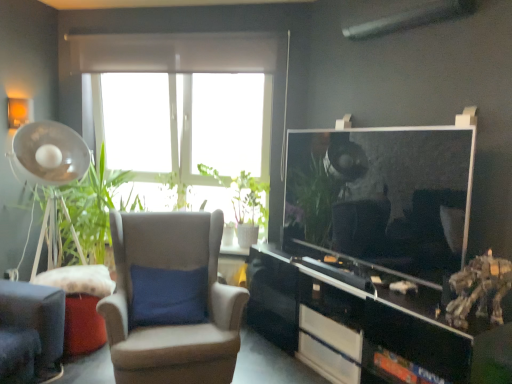
Where is `suede wingback chair at center`? The image size is (512, 384). suede wingback chair at center is located at coordinates (170, 301).

What do you see at coordinates (371, 323) in the screenshot? The image size is (512, 384). I see `black glossy cabinet at lower right` at bounding box center [371, 323].

Locate an element on the screen. Image resolution: width=512 pixels, height=384 pixels. white glossy drawer at lower center, which ranks as the 2th drawer in bottom-to-top order is located at coordinates (331, 332).

The height and width of the screenshot is (384, 512). I want to click on suede wingback chair at center, so click(x=170, y=301).

Could you tell me if green matte plant at center is facing white glossy drawer at lower center, placed as the first drawer when sorted from bottom to top?

No, green matte plant at center is not aimed at white glossy drawer at lower center, placed as the first drawer when sorted from bottom to top.

Is green matte plant at center behind white glossy drawer at lower center, placed as the first drawer when sorted from bottom to top?

Yes, green matte plant at center is further from the viewer.

Is green matte plant at center at the right side of white glossy drawer at lower center, placed as the 2th drawer when sorted from top to bottom?

No, green matte plant at center is not to the right of white glossy drawer at lower center, placed as the 2th drawer when sorted from top to bottom.

From a real-world perspective, who is located lower, green matte plant at center or white glossy drawer at lower center, placed as the first drawer when sorted from bottom to top?

In real-world perspective, white glossy drawer at lower center, placed as the first drawer when sorted from bottom to top, is lower.

Is white glossy drawer at lower center, placed as the first drawer when sorted from bottom to top, wider or thinner than white glossy drawer at lower center, which is the 1th drawer in top-to-bottom order?

Considering their sizes, white glossy drawer at lower center, placed as the first drawer when sorted from bottom to top, looks slimmer than white glossy drawer at lower center, which is the 1th drawer in top-to-bottom order.

What's the angular difference between white glossy drawer at lower center, placed as the 2th drawer when sorted from top to bottom, and white glossy drawer at lower center, which ranks as the 2th drawer in bottom-to-top order,'s facing directions?

0.000309 degrees.

Which of these two, white glossy drawer at lower center, placed as the first drawer when sorted from bottom to top, or white glossy drawer at lower center, which is the 1th drawer in top-to-bottom order, stands shorter?

With less height is white glossy drawer at lower center, placed as the first drawer when sorted from bottom to top.

From the picture: Is white glossy drawer at lower center, placed as the first drawer when sorted from bottom to top, aimed at white glossy drawer at lower center, which ranks as the 2th drawer in bottom-to-top order?

No, white glossy drawer at lower center, placed as the first drawer when sorted from bottom to top, is not turned towards white glossy drawer at lower center, which ranks as the 2th drawer in bottom-to-top order.

Which object is thinner, white glossy drawer at lower center, which ranks as the 2th drawer in bottom-to-top order, or suede wingback chair at center?

white glossy drawer at lower center, which ranks as the 2th drawer in bottom-to-top order, is thinner.

Who is taller, white glossy drawer at lower center, which is the 1th drawer in top-to-bottom order, or suede wingback chair at center?

With more height is suede wingback chair at center.

Is white glossy drawer at lower center, which ranks as the 2th drawer in bottom-to-top order, looking in the opposite direction of suede wingback chair at center?

white glossy drawer at lower center, which ranks as the 2th drawer in bottom-to-top order, does not have its back to suede wingback chair at center.

How far apart are white glossy drawer at lower center, which ranks as the 2th drawer in bottom-to-top order, and suede wingback chair at center?

They are 88.09 centimeters apart.

Which is correct: black glossy cabinet at lower right is inside green matte plant at center, or outside of it?

black glossy cabinet at lower right is located beyond the bounds of green matte plant at center.

In the scene shown: Can you confirm if black glossy cabinet at lower right is bigger than green matte plant at center?

Yes.

Considering the positions of objects black glossy cabinet at lower right and green matte plant at center in the image provided, who is more to the right, black glossy cabinet at lower right or green matte plant at center?

From the viewer's perspective, black glossy cabinet at lower right appears more on the right side.

The height and width of the screenshot is (384, 512). What are the coordinates of `houseplant behind the black glossy cabinet at lower right` in the screenshot? It's located at (249, 206).

Which is in front, point (334, 345) or point (499, 383)?

Positioned in front is point (499, 383).

Looking at this image, from a real-world perspective, relative to black glossy cabinet at lower right, is white glossy drawer at lower center, which ranks as the 2th drawer in bottom-to-top order, vertically above or below?

From a real-world perspective, white glossy drawer at lower center, which ranks as the 2th drawer in bottom-to-top order, is physically below black glossy cabinet at lower right.

How different are the orientations of white glossy drawer at lower center, which ranks as the 2th drawer in bottom-to-top order, and black glossy cabinet at lower right in degrees?

The angular difference between white glossy drawer at lower center, which ranks as the 2th drawer in bottom-to-top order, and black glossy cabinet at lower right is 0.0832 degrees.

Could you tell me if white glossy drawer at lower center, which is the 1th drawer in top-to-bottom order, is facing black glossy cabinet at lower right?

Yes, white glossy drawer at lower center, which is the 1th drawer in top-to-bottom order, is aimed at black glossy cabinet at lower right.

Between black glossy cabinet at lower right and white glossy drawer at lower center, which ranks as the 2th drawer in bottom-to-top order, which one appears on the left side from the viewer's perspective?

From the viewer's perspective, white glossy drawer at lower center, which ranks as the 2th drawer in bottom-to-top order, appears more on the left side.

Is black glossy cabinet at lower right taller than white glossy drawer at lower center, which ranks as the 2th drawer in bottom-to-top order?

Indeed, black glossy cabinet at lower right has a greater height compared to white glossy drawer at lower center, which ranks as the 2th drawer in bottom-to-top order.

From the image's perspective, is black glossy cabinet at lower right located above white glossy drawer at lower center, which is the 1th drawer in top-to-bottom order?

Indeed, from the image's perspective, black glossy cabinet at lower right is shown above white glossy drawer at lower center, which is the 1th drawer in top-to-bottom order.

Based on their sizes in the image, would you say black glossy cabinet at lower right is bigger or smaller than white glossy drawer at lower center, which is the 1th drawer in top-to-bottom order?

Clearly, black glossy cabinet at lower right is larger in size than white glossy drawer at lower center, which is the 1th drawer in top-to-bottom order.

Who is bigger, white glossy drawer at lower center, placed as the first drawer when sorted from bottom to top, or suede wingback chair at center?

suede wingback chair at center is bigger.

Between white glossy drawer at lower center, placed as the first drawer when sorted from bottom to top, and suede wingback chair at center, which one has larger width?

suede wingback chair at center.

Can we say white glossy drawer at lower center, placed as the first drawer when sorted from bottom to top, lies outside suede wingback chair at center?

Absolutely, white glossy drawer at lower center, placed as the first drawer when sorted from bottom to top, is external to suede wingback chair at center.

Considering the positions of point (331, 357) and point (157, 368), is point (331, 357) closer or farther from the camera than point (157, 368)?

Point (331, 357).

You are a GUI agent. You are given a task and a screenshot of the screen. Output one action in this format:
    pyautogui.click(x=<x>, y=<y>)
    Task: Click on the houseplant above the white glossy drawer at lower center, placed as the 2th drawer when sorted from top to bottom (from a real-world perspective)
    Image resolution: width=512 pixels, height=384 pixels.
    Given the screenshot: What is the action you would take?
    pyautogui.click(x=249, y=206)

This screenshot has width=512, height=384. In the image, there is a white glossy drawer at lower center, which is the 1th drawer in top-to-bottom order. In order to click on drawer below it (from the image's perspective) in this screenshot , I will do `click(327, 361)`.

Considering their positions, is black glossy cabinet at lower right positioned closer to white glossy drawer at lower center, which is the 1th drawer in top-to-bottom order, than green matte plant at center?

Based on the image, black glossy cabinet at lower right appears to be nearer to white glossy drawer at lower center, which is the 1th drawer in top-to-bottom order.

Estimate the real-world distances between objects in this image. Which object is further from green matte plant at center, black glossy cabinet at lower right or white glossy drawer at lower center, placed as the 2th drawer when sorted from top to bottom?

white glossy drawer at lower center, placed as the 2th drawer when sorted from top to bottom, is further to green matte plant at center.

Looking at the image, which one is located further to green matte plant at center, black glossy cabinet at lower right or suede wingback chair at center?

The object further to green matte plant at center is suede wingback chair at center.

Which object lies further to the anchor point white glossy drawer at lower center, which ranks as the 2th drawer in bottom-to-top order, white glossy drawer at lower center, placed as the 2th drawer when sorted from top to bottom, or suede wingback chair at center?

suede wingback chair at center is positioned further to the anchor white glossy drawer at lower center, which ranks as the 2th drawer in bottom-to-top order.

Based on their spatial positions, is white glossy drawer at lower center, which ranks as the 2th drawer in bottom-to-top order, or black glossy cabinet at lower right closer to suede wingback chair at center?

black glossy cabinet at lower right lies closer to suede wingback chair at center than the other object.

Based on their spatial positions, is white glossy drawer at lower center, placed as the first drawer when sorted from bottom to top, or green matte plant at center further from suede wingback chair at center?

The object further to suede wingback chair at center is green matte plant at center.

Looking at the image, which one is located closer to white glossy drawer at lower center, which ranks as the 2th drawer in bottom-to-top order, white glossy drawer at lower center, placed as the 2th drawer when sorted from top to bottom, or black glossy cabinet at lower right?

white glossy drawer at lower center, placed as the 2th drawer when sorted from top to bottom, is closer to white glossy drawer at lower center, which ranks as the 2th drawer in bottom-to-top order.

Which object lies nearer to the anchor point green matte plant at center, suede wingback chair at center or white glossy drawer at lower center, which is the 1th drawer in top-to-bottom order?

Among the two, suede wingback chair at center is located nearer to green matte plant at center.

The width and height of the screenshot is (512, 384). I want to click on drawer located between white glossy drawer at lower center, which ranks as the 2th drawer in bottom-to-top order, and green matte plant at center in the depth direction, so click(x=327, y=361).

The image size is (512, 384). Find the location of `drawer between suede wingback chair at center and white glossy drawer at lower center, which ranks as the 2th drawer in bottom-to-top order`. drawer between suede wingback chair at center and white glossy drawer at lower center, which ranks as the 2th drawer in bottom-to-top order is located at coordinates (327, 361).

Locate an element on the screen. drawer positioned between black glossy cabinet at lower right and white glossy drawer at lower center, placed as the 2th drawer when sorted from top to bottom, from near to far is located at coordinates (331, 332).

Identify the location of chair located between black glossy cabinet at lower right and green matte plant at center in the depth direction. (170, 301).